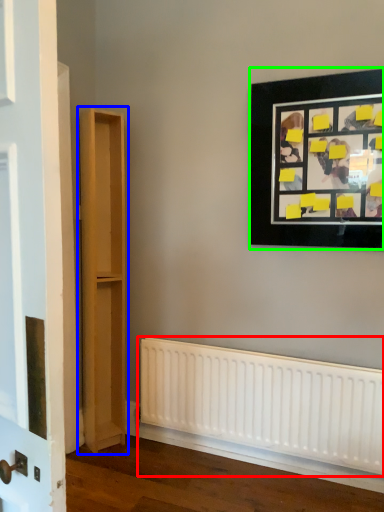
Question: Estimate the real-world distances between objects in this image. Which object is closer to radiator (highlighted by a red box), bookshelf (highlighted by a blue box) or picture frame (highlighted by a green box)?

Choices:
 (A) bookshelf
 (B) picture frame

Answer: (A)